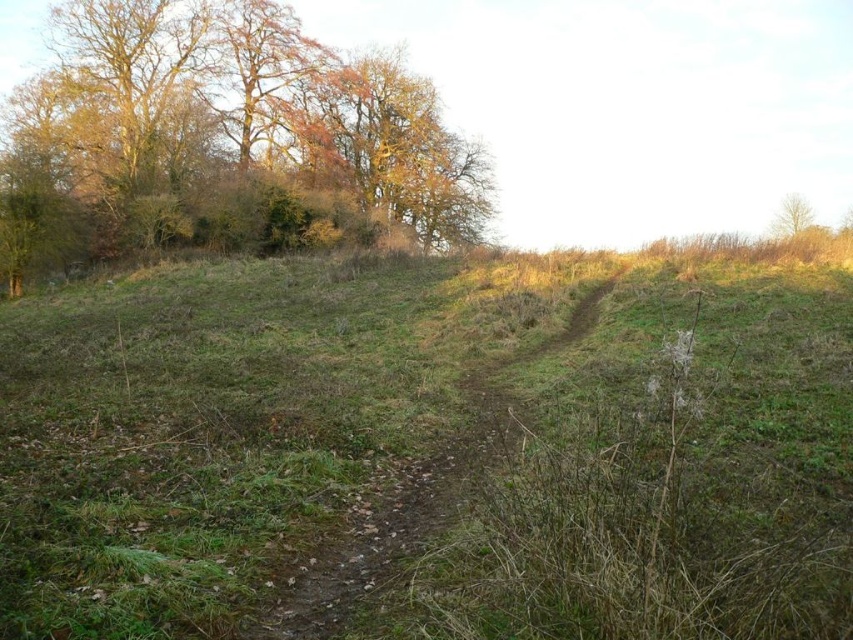
Which of these two, green grassy at center or dirt path at center, stands taller?

With more height is green grassy at center.

Is green grassy at center above dirt path at center?

Correct, green grassy at center is located above dirt path at center.

Where is `green grassy at center`? Image resolution: width=853 pixels, height=640 pixels. green grassy at center is located at coordinates (428, 452).

Who is lower down, green grassy at center or brown leafy trees at upper left?

green grassy at center is lower down.

Between green grassy at center and brown leafy trees at upper left, which one appears on the right side from the viewer's perspective?

green grassy at center

From the picture: Who is more forward, (697, 436) or (444, 208)?

Positioned in front is point (697, 436).

Identify the location of green grassy at center. This screenshot has height=640, width=853. (428, 452).

Can you confirm if brown leafy trees at upper left is thinner than dirt path at center?

In fact, brown leafy trees at upper left might be wider than dirt path at center.

Identify the location of brown leafy trees at upper left. (223, 140).

Where is `brown leafy trees at upper left`? This screenshot has width=853, height=640. brown leafy trees at upper left is located at coordinates (223, 140).